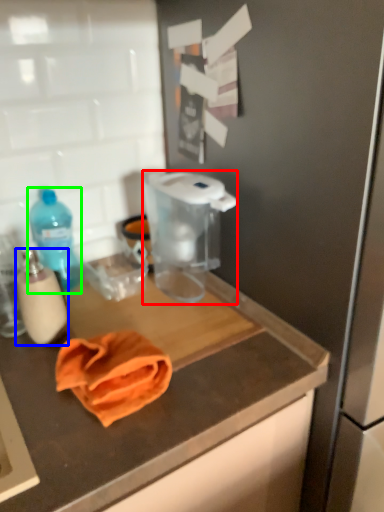
Question: Considering the real-world distances, which object is farthest from appliance (highlighted by a red box)? bottle (highlighted by a blue box) or bottle (highlighted by a green box)?

Choices:
 (A) bottle
 (B) bottle

Answer: (A)